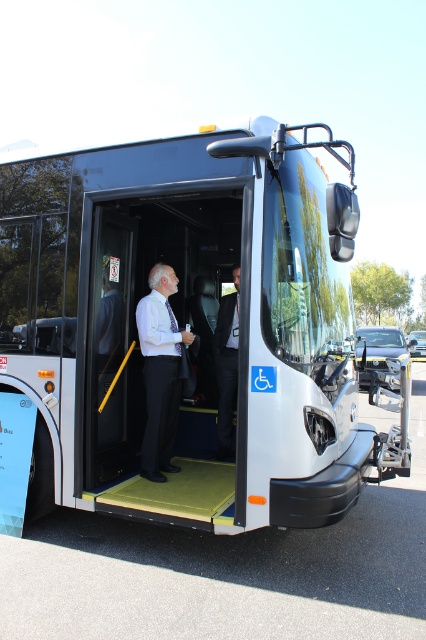
Is white metallic bus at center further to the viewer compared to white glossy shirt at center?

No, white metallic bus at center is closer to the viewer.

Which is more to the left, white metallic bus at center or white glossy shirt at center?

From the viewer's perspective, white glossy shirt at center appears more on the left side.

Locate an element on the screen. The image size is (426, 640). white metallic bus at center is located at coordinates (184, 317).

Does white metallic bus at center appear under dark gray suit at center?

Incorrect, white metallic bus at center is not positioned below dark gray suit at center.

Who is more distant from viewer, (74, 282) or (215, 362)?

The point (215, 362) is more distant.

You are a GUI agent. You are given a task and a screenshot of the screen. Output one action in this format:
    pyautogui.click(x=<x>, y=<y>)
    Task: Click on the white metallic bus at center
    The image size is (426, 640).
    Given the screenshot: What is the action you would take?
    pyautogui.click(x=184, y=317)

Is white glossy shirt at center thinner than dark gray suit at center?

In fact, white glossy shirt at center might be wider than dark gray suit at center.

Is the position of white glossy shirt at center more distant than that of dark gray suit at center?

No.

Between point (146, 465) and point (224, 428), which one is positioned behind?

The point (224, 428) is more distant.

Locate an element on the screen. white glossy shirt at center is located at coordinates (160, 371).